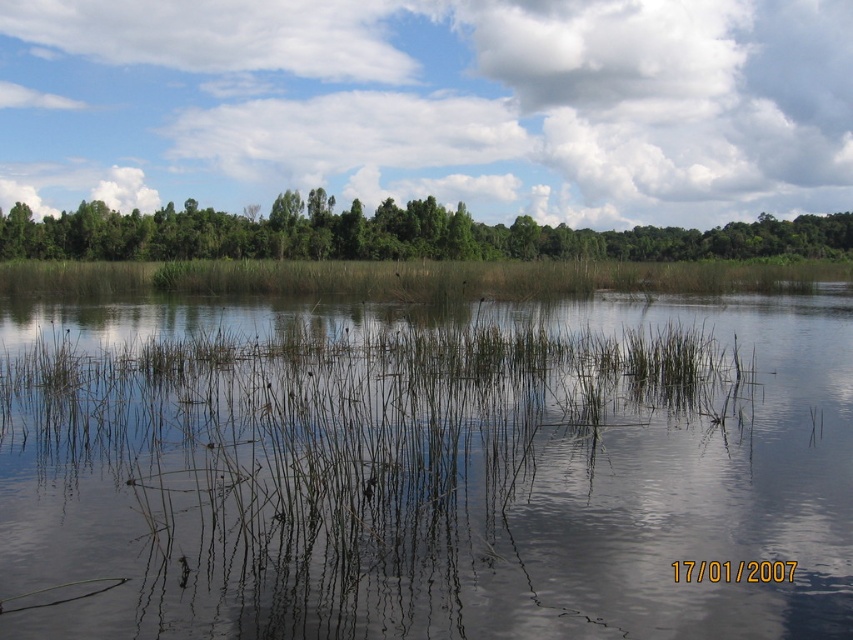
You are a bird flying over the wetland. You see the green grass at center and the white fluffy cloud at upper left. Which one is closer to you?

The green grass at center is closer to you because it is in front of the white fluffy cloud at upper left.

You are an observer looking at the wetland scene. You notice the white fluffy cloud at upper center and the green leafy trees at upper center. Which object is located higher in the image?

The white fluffy cloud at upper center is positioned over the green leafy trees at upper center, so it is higher in the image.